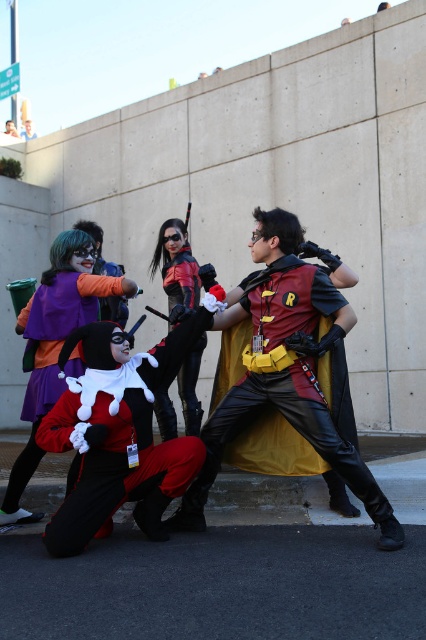
You are organizing a photo shoot and need to place two red costumes in the center of the frame. The shiny red vest at center and the matte red costume at center. Which one should you choose if you want the costume to take up more horizontal space?

The shiny red vest at center is wider than the matte red costume at center, so it would take up more horizontal space in the frame.

You are standing at the point with coordinates point [397,540] and want to move to the point with coordinates point [172,348]. Is the path between these two points clear of any obstacles?

The point [397,540] is closer to the viewer than point [172,348], so the path between them may be obstructed by the Harley Quinn character who is crouched in the foreground.